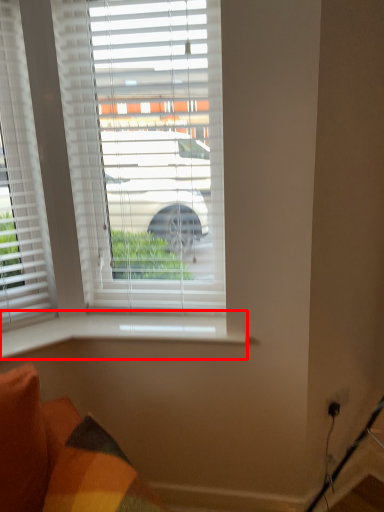
Question: Considering the relative positions of window sill (annotated by the red box) and window in the image provided, where is window sill (annotated by the red box) located with respect to the staircase?

Choices:
 (A) right
 (B) left

Answer: (A)